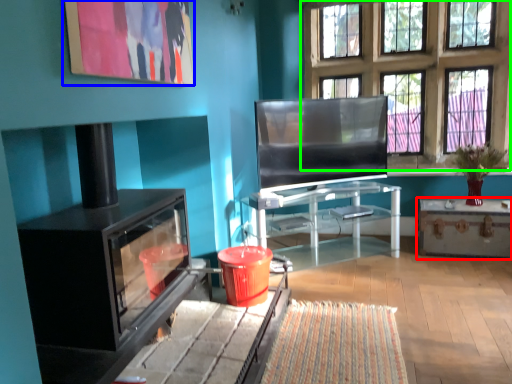
Question: Which object is the closest to the table (highlighted by a red box)? Choose among these: picture frame (highlighted by a blue box) or window (highlighted by a green box).

Choices:
 (A) picture frame
 (B) window

Answer: (B)